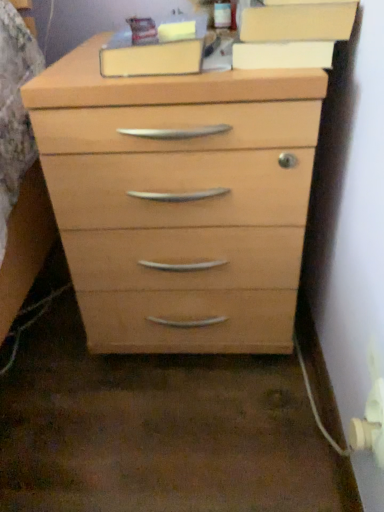
Question: From the image's perspective, relative to matte wood cabinet at upper center, is light wood chest of drawers at center above or below?

Choices:
 (A) above
 (B) below

Answer: (B)

Question: In the image, is light wood chest of drawers at center on the left side or the right side of matte wood cabinet at upper center?

Choices:
 (A) left
 (B) right

Answer: (A)

Question: Considering the positions of light wood chest of drawers at center and matte wood cabinet at upper center in the image, is light wood chest of drawers at center wider or thinner than matte wood cabinet at upper center?

Choices:
 (A) thin
 (B) wide

Answer: (B)

Question: Based on their positions, is matte wood cabinet at upper center located to the left or right of light wood chest of drawers at center?

Choices:
 (A) left
 (B) right

Answer: (B)

Question: Is matte wood cabinet at upper center in front of or behind light wood chest of drawers at center in the image?

Choices:
 (A) behind
 (B) front

Answer: (A)

Question: Is matte wood cabinet at upper center wider or thinner than light wood chest of drawers at center?

Choices:
 (A) thin
 (B) wide

Answer: (A)

Question: Which is correct: matte wood cabinet at upper center is inside light wood chest of drawers at center, or outside of it?

Choices:
 (A) inside
 (B) outside

Answer: (B)